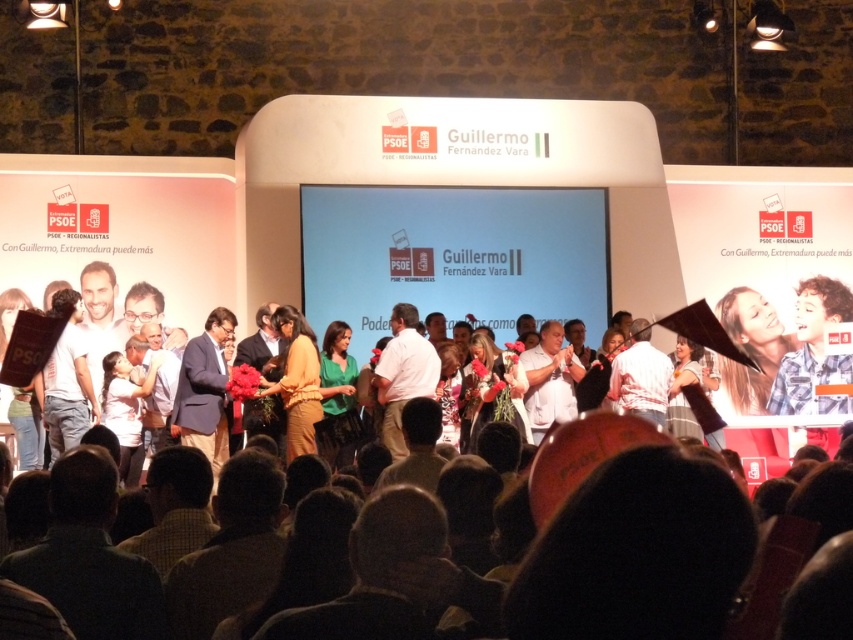
Who is lower down, matte yellow dress at center or white cotton shirt at center?

white cotton shirt at center is lower down.

Can you confirm if matte yellow dress at center is taller than white cotton shirt at center?

Yes, matte yellow dress at center is taller than white cotton shirt at center.

You are a GUI agent. You are given a task and a screenshot of the screen. Output one action in this format:
    pyautogui.click(x=<x>, y=<y>)
    Task: Click on the matte yellow dress at center
    
    Given the screenshot: What is the action you would take?
    pyautogui.click(x=297, y=381)

Between green matte shirt at center and white cotton shirt at center, which one has more height?

green matte shirt at center

The image size is (853, 640). What do you see at coordinates (337, 397) in the screenshot?
I see `green matte shirt at center` at bounding box center [337, 397].

The image size is (853, 640). In order to click on green matte shirt at center in this screenshot , I will do `click(337, 397)`.

Does matte yellow dress at center appear over green matte shirt at center?

Indeed, matte yellow dress at center is positioned over green matte shirt at center.

Measure the distance between point (309, 332) and camera.

Point (309, 332) is 232.28 feet from camera.

Image resolution: width=853 pixels, height=640 pixels. In order to click on matte yellow dress at center in this screenshot , I will do `click(297, 381)`.